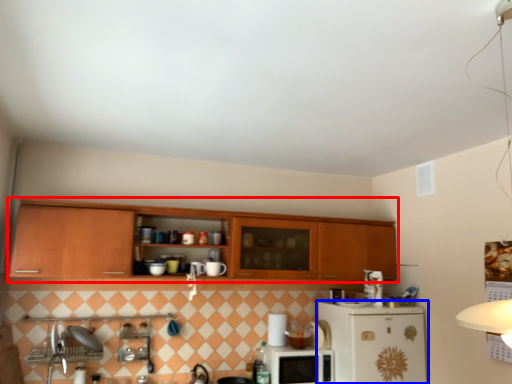
Question: Which point is closer to the camera, cabinetry (highlighted by a red box) or refrigerator (highlighted by a blue box)?

Choices:
 (A) cabinetry
 (B) refrigerator

Answer: (A)